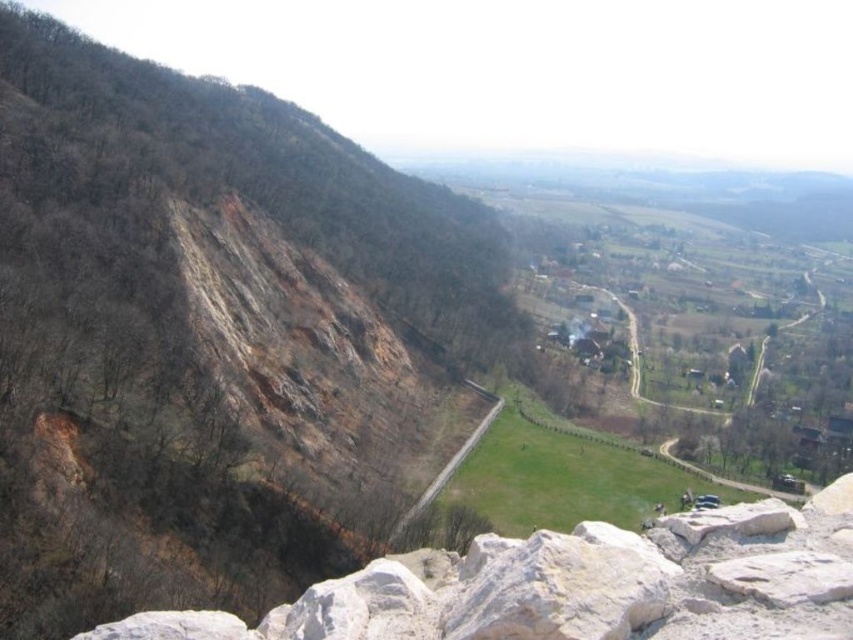
You are a hiker standing at the edge of the valley. You see the white rough rock at lower left and the green grassy field at center. Which of these two objects is smaller in size?

The white rough rock at lower left is smaller in size compared to the green grassy field at center.

You are a hiker standing at the center of the valley. You need to reach a white rough rock at lower left. Which direction should you move to get closer to it?

The white rough rock at lower left is located at point (x=579, y=586), so you should move towards the lower left direction to reach it.